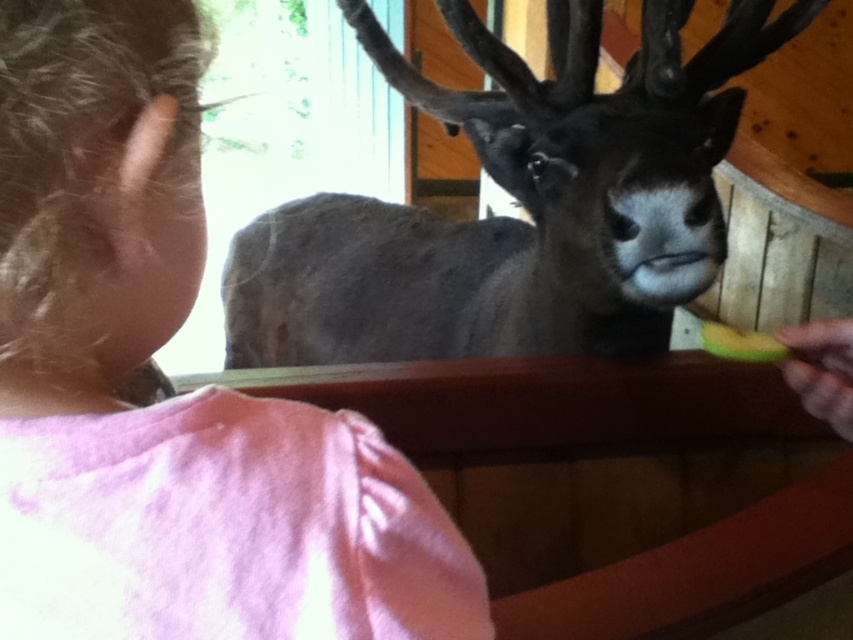
Question: Where is pink fabric shirt at upper left located in relation to dark brown fur at center in the image?

Choices:
 (A) right
 (B) left

Answer: (B)

Question: Considering the relative positions of pink fabric shirt at upper left and dark brown fur at center in the image provided, where is pink fabric shirt at upper left located with respect to dark brown fur at center?

Choices:
 (A) left
 (B) right

Answer: (A)

Question: Which of the following is the closest to the observer?

Choices:
 (A) pink fabric shirt at upper left
 (B) dark brown fur at center

Answer: (A)

Question: Is pink fabric shirt at upper left above dark brown fur at center?

Choices:
 (A) no
 (B) yes

Answer: (A)